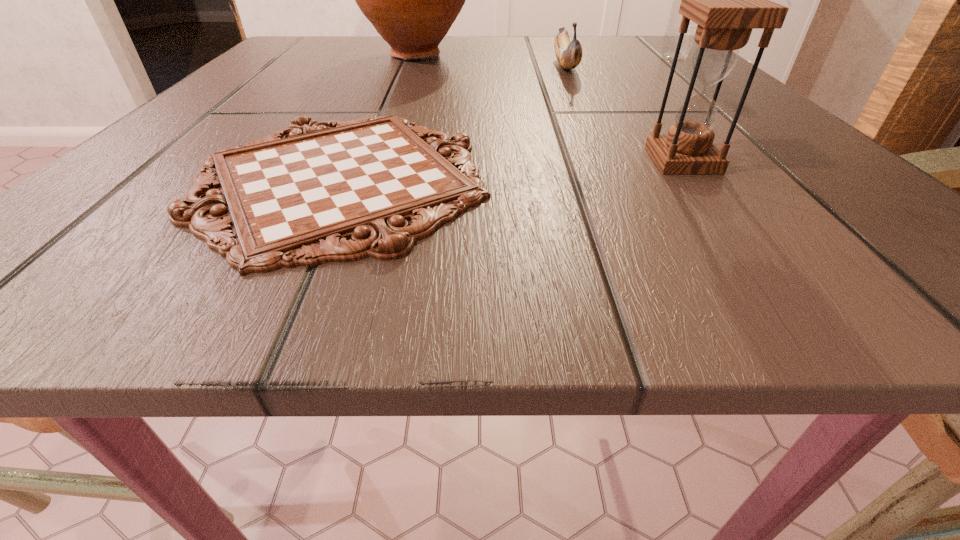
Where is `pottery`? pottery is located at coordinates (412, 0).

The width and height of the screenshot is (960, 540). What are the coordinates of `the rightmost object` in the screenshot? It's located at (671, 36).

Where is `the second object from right to left`? the second object from right to left is located at coordinates (727, 0).

You are a GUI agent. You are given a task and a screenshot of the screen. Output one action in this format:
    pyautogui.click(x=<x>, y=<y>)
    Task: Click on the hourglass
    
    Given the screenshot: What is the action you would take?
    pyautogui.click(x=727, y=0)

The width and height of the screenshot is (960, 540). Identify the location of banana. (569, 54).

At what (x,y) coordinates should I click in order to perform the action: click on the third object from right to left. Please return your answer as a coordinate pair (x, y). Looking at the image, I should click on (569, 54).

What are the coordinates of `the shortest object` in the screenshot? It's located at (294, 198).

Identify the location of free space located on the side of the pottery with the handle. (405, 83).

What are the coordinates of `vacant region located 0.070m on the back of the water bottle` in the screenshot? It's located at (658, 44).

Where is `free region located 0.110m on the right of the hourglass`? The width and height of the screenshot is (960, 540). free region located 0.110m on the right of the hourglass is located at coordinates (808, 160).